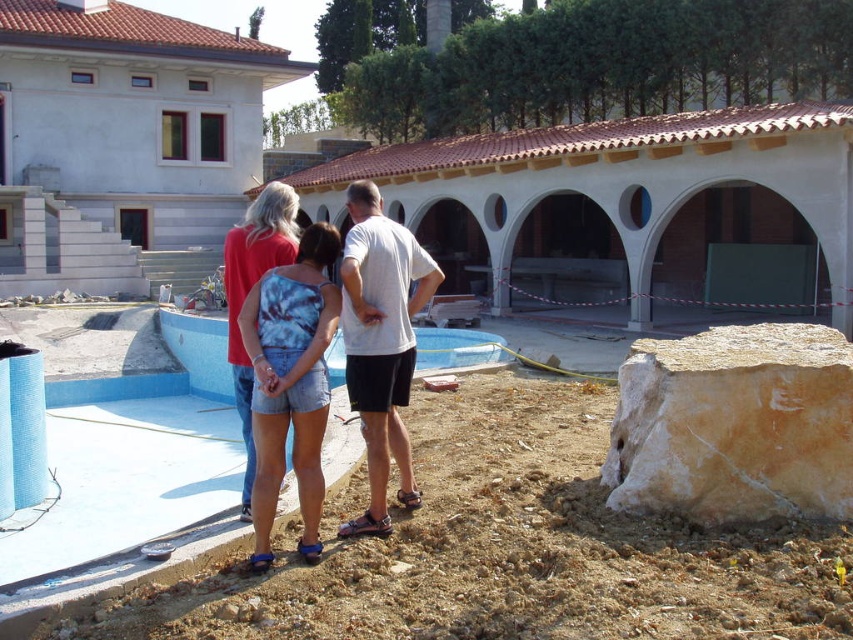
Is blue tie-dye tank top at center bigger than blue smooth pool at center?

No, blue tie-dye tank top at center is not bigger than blue smooth pool at center.

Who is higher up, blue tie-dye tank top at center or blue smooth pool at center?

Positioned higher is blue smooth pool at center.

Describe the element at coordinates (289, 381) in the screenshot. I see `blue tie-dye tank top at center` at that location.

The width and height of the screenshot is (853, 640). Find the location of `blue tie-dye tank top at center`. blue tie-dye tank top at center is located at coordinates (289, 381).

Can you confirm if tie-dye fabric shorts at center is bigger than blue smooth pool at center?

No.

Does tie-dye fabric shorts at center have a greater height compared to blue smooth pool at center?

Indeed, tie-dye fabric shorts at center has a greater height compared to blue smooth pool at center.

Who is more forward, [338,298] or [164,321]?

Point [338,298] is in front.

At what (x,y) coordinates should I click in order to perform the action: click on tie-dye fabric shorts at center. Please return your answer as a coordinate pair (x, y). The height and width of the screenshot is (640, 853). Looking at the image, I should click on (289, 381).

Is yellowish stone boulder at lower right to the right of tie-dye fabric shorts at center from the viewer's perspective?

Indeed, yellowish stone boulder at lower right is positioned on the right side of tie-dye fabric shorts at center.

Does point (708, 376) come in front of point (316, 324)?

No.

Identify the location of yellowish stone boulder at lower right. Image resolution: width=853 pixels, height=640 pixels. (734, 424).